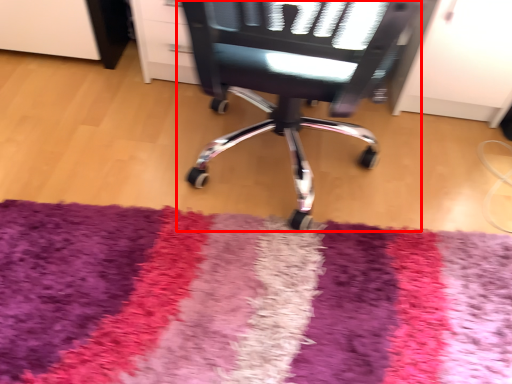
Question: From the image's perspective, what is the correct spatial relationship of chair (annotated by the red box) in relation to mat?

Choices:
 (A) above
 (B) below

Answer: (A)